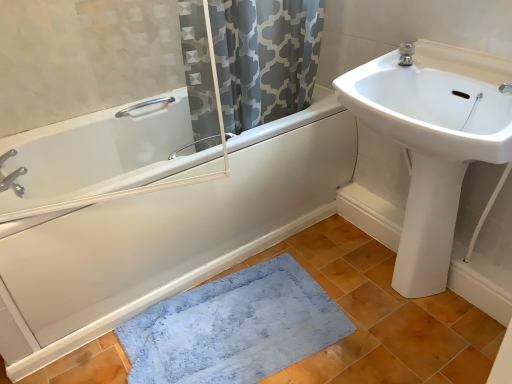
Image resolution: width=512 pixels, height=384 pixels. I want to click on vacant area situated to the left side of white glossy bidet at right, so click(362, 292).